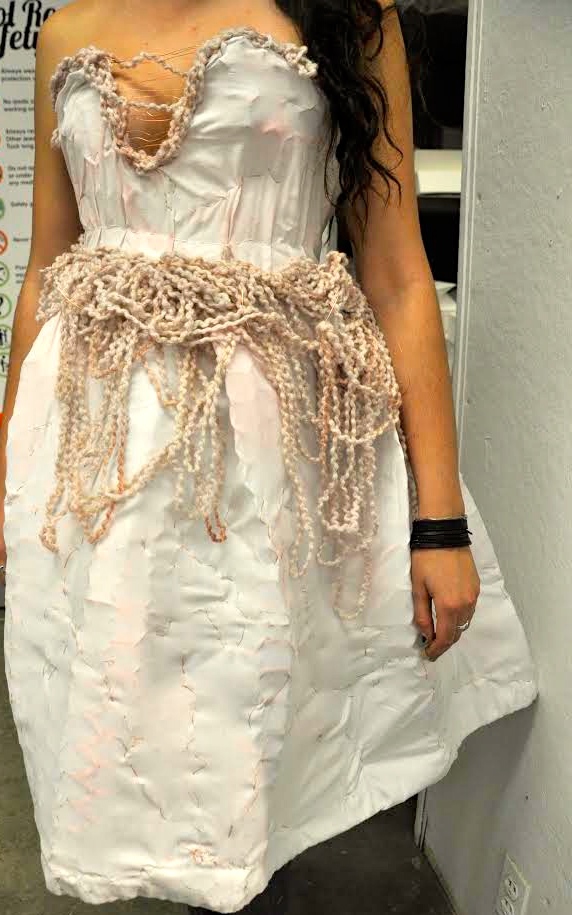
Find the location of `outlets`. outlets is located at coordinates (509, 888), (506, 903).